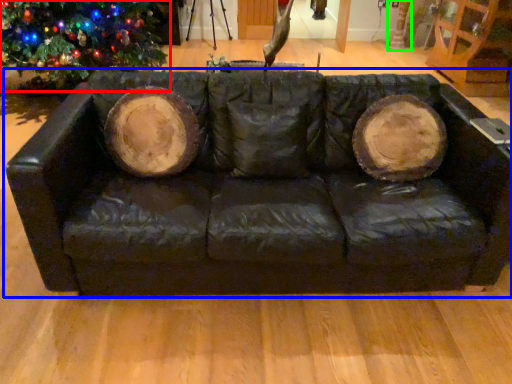
Question: Which object is the farthest from christmas tree (highlighted by a red box)? Choose among these: studio couch (highlighted by a blue box) or tree trunk (highlighted by a green box).

Choices:
 (A) studio couch
 (B) tree trunk

Answer: (B)